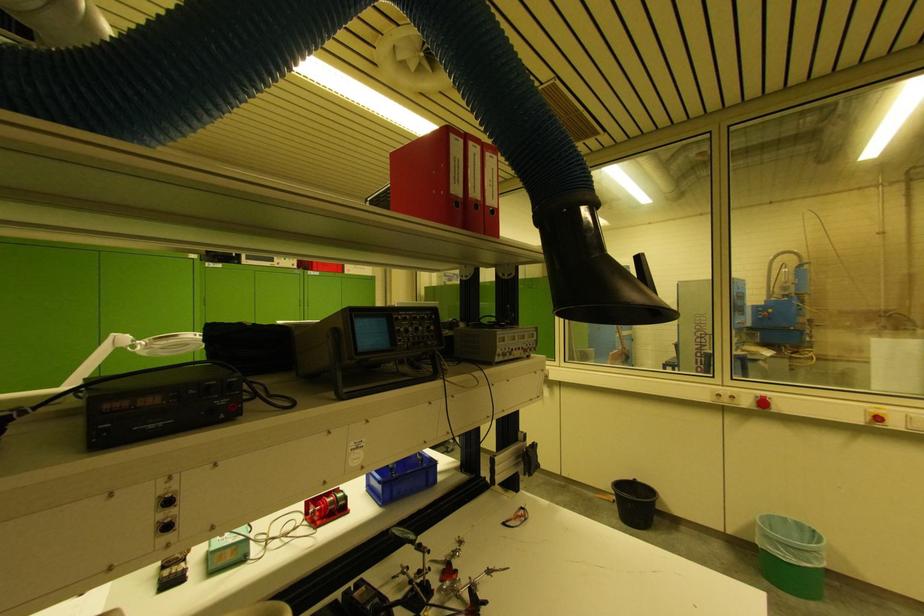
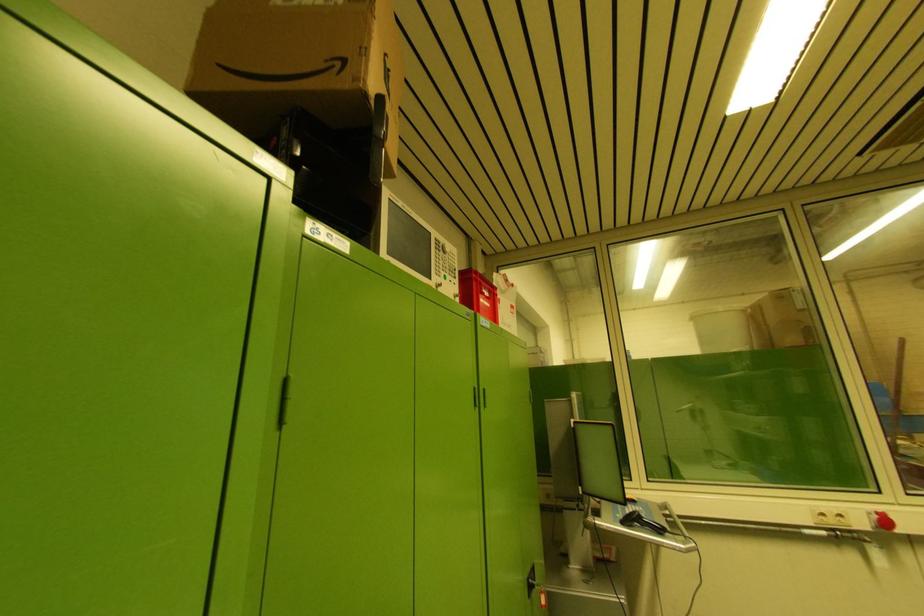
The images are taken continuously from a first-person perspective. In which direction are you moving?

The cameraman walked toward left, forward.